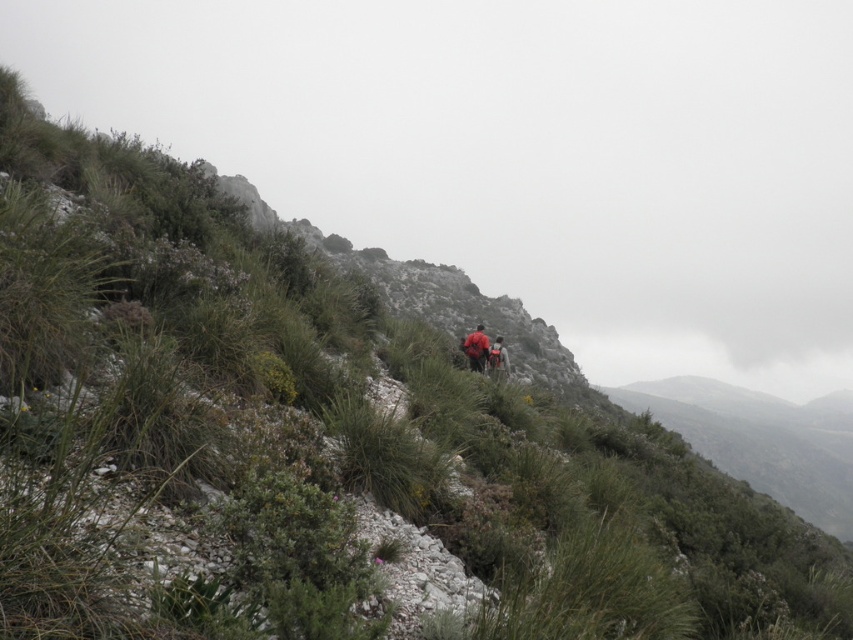
Question: Where is red fabric backpack at center located in relation to orange fabric backpack at center in the image?

Choices:
 (A) above
 (B) below

Answer: (A)

Question: Among these objects, which one is farthest from the camera?

Choices:
 (A) orange fabric backpack at center
 (B) red fabric backpack at center

Answer: (B)

Question: Is red fabric backpack at center bigger than orange fabric backpack at center?

Choices:
 (A) no
 (B) yes

Answer: (A)

Question: Does red fabric backpack at center appear on the right side of orange fabric backpack at center?

Choices:
 (A) yes
 (B) no

Answer: (B)